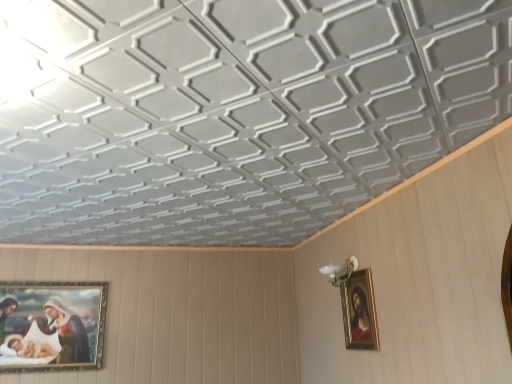
Question: From the image's perspective, does gold-framed painting at lower left, placed as the 1th picture frame when sorted from left to right, appear higher than gold-framed painting at upper right, acting as the 1th picture frame starting from the right?

Choices:
 (A) no
 (B) yes

Answer: (A)

Question: Can you confirm if gold-framed painting at lower left, the second picture frame positioned from the front, is shorter than gold-framed painting at upper right, which is the second picture frame from back to front?

Choices:
 (A) no
 (B) yes

Answer: (A)

Question: Is gold-framed painting at lower left, the second picture frame from the right, thinner than gold-framed painting at upper right, placed as the first picture frame when sorted from front to back?

Choices:
 (A) yes
 (B) no

Answer: (A)

Question: Can you confirm if gold-framed painting at lower left, placed as the 1th picture frame when sorted from left to right, is positioned to the right of gold-framed painting at upper right, acting as the 1th picture frame starting from the right?

Choices:
 (A) yes
 (B) no

Answer: (B)

Question: From a real-world perspective, is gold-framed painting at lower left, placed as the 1th picture frame when sorted from left to right, physically below gold-framed painting at upper right, which is the second picture frame from back to front?

Choices:
 (A) no
 (B) yes

Answer: (B)

Question: From a real-world perspective, does gold-framed painting at lower left, placed as the 1th picture frame when sorted from left to right, stand above gold-framed painting at upper right, acting as the 1th picture frame starting from the right?

Choices:
 (A) no
 (B) yes

Answer: (A)

Question: Does gold-framed painting at upper right, which is the second picture frame from back to front, have a lesser width compared to gold-framed painting at lower left, the second picture frame from the right?

Choices:
 (A) no
 (B) yes

Answer: (A)

Question: Can you confirm if gold-framed painting at upper right, acting as the 1th picture frame starting from the right, is wider than gold-framed painting at lower left, the first picture frame positioned from the back?

Choices:
 (A) no
 (B) yes

Answer: (B)

Question: Is gold-framed painting at upper right, which is the second picture frame from back to front, oriented towards gold-framed painting at lower left, the first picture frame positioned from the back?

Choices:
 (A) no
 (B) yes

Answer: (A)

Question: Is gold-framed painting at upper right, which appears as the second picture frame when viewed from the left, closer to camera compared to gold-framed painting at lower left, the second picture frame from the right?

Choices:
 (A) yes
 (B) no

Answer: (A)

Question: From a real-world perspective, is gold-framed painting at upper right, which appears as the second picture frame when viewed from the left, located higher than gold-framed painting at lower left, the second picture frame positioned from the front?

Choices:
 (A) yes
 (B) no

Answer: (A)

Question: Is gold-framed painting at lower left, the first picture frame positioned from the back, at the back of gold-framed painting at upper right, acting as the 1th picture frame starting from the right?

Choices:
 (A) no
 (B) yes

Answer: (A)

Question: From the image's perspective, is gold-framed painting at lower left, the first picture frame positioned from the back, positioned above or below gold-framed painting at upper right, placed as the first picture frame when sorted from front to back?

Choices:
 (A) below
 (B) above

Answer: (A)